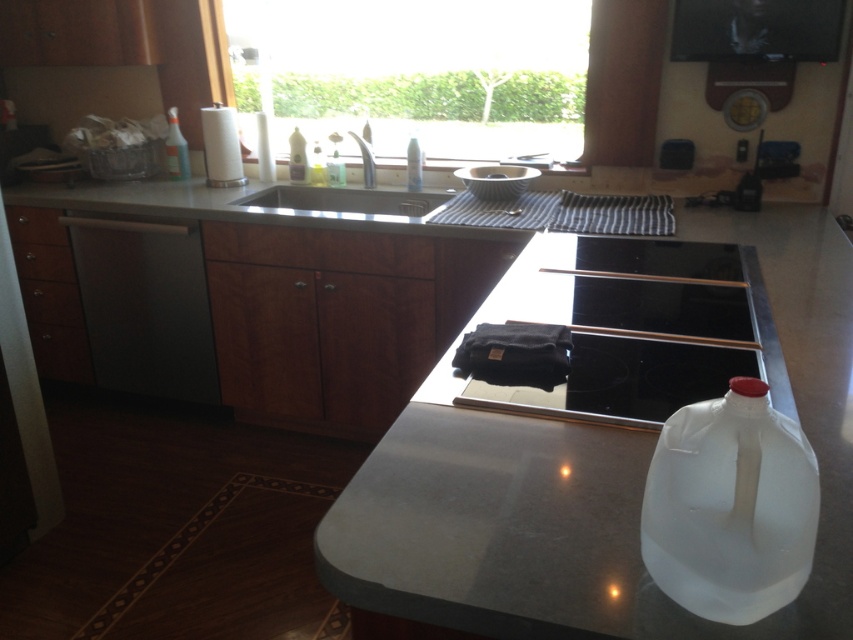
Does white glossy counter top at center appear on the right side of transparent plastic spray bottle at upper left?

Yes, white glossy counter top at center is to the right of transparent plastic spray bottle at upper left.

Identify the location of white glossy counter top at center. The height and width of the screenshot is (640, 853). (804, 312).

Is satin black dishwasher at left smaller than black glass cooktop at center?

No, satin black dishwasher at left is not smaller than black glass cooktop at center.

Can you confirm if satin black dishwasher at left is taller than black glass cooktop at center?

Yes, satin black dishwasher at left is taller than black glass cooktop at center.

Is point (160, 284) positioned before point (669, 288)?

No, (160, 284) is behind (669, 288).

Image resolution: width=853 pixels, height=640 pixels. I want to click on satin black dishwasher at left, so click(x=144, y=305).

Does transparent plastic spray bottle at upper left have a smaller size compared to clear plastic bottle at sink?

No, transparent plastic spray bottle at upper left is not smaller than clear plastic bottle at sink.

Is the position of transparent plastic spray bottle at upper left less distant than that of clear plastic bottle at sink?

No, transparent plastic spray bottle at upper left is behind clear plastic bottle at sink.

Where is `transparent plastic spray bottle at upper left`? transparent plastic spray bottle at upper left is located at coordinates (177, 148).

This screenshot has width=853, height=640. What are the coordinates of `transparent plastic spray bottle at upper left` in the screenshot? It's located at click(177, 148).